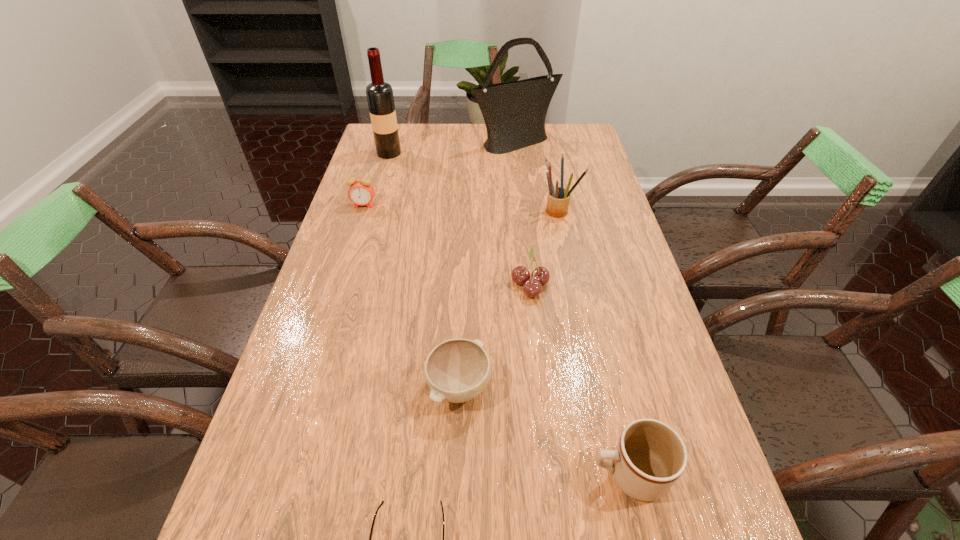
Where is `blank area located 0.140m on the front of the third tallest object`? blank area located 0.140m on the front of the third tallest object is located at coordinates (568, 251).

Locate an element on the screen. The image size is (960, 540). free spot located 0.220m on the face of the alarm clock is located at coordinates (348, 258).

You are a GUI agent. You are given a task and a screenshot of the screen. Output one action in this format:
    pyautogui.click(x=<x>, y=<y>)
    Task: Click on the free space located on the side of the mug with the handle
    The height and width of the screenshot is (540, 960).
    Given the screenshot: What is the action you would take?
    pyautogui.click(x=464, y=474)

Where is `vacant space located 0.310m on the side of the mug with the handle`? The image size is (960, 540). vacant space located 0.310m on the side of the mug with the handle is located at coordinates (413, 474).

Where is `free space located 0.060m on the side of the mug with the handle`? free space located 0.060m on the side of the mug with the handle is located at coordinates (555, 474).

At what (x,y) coordinates should I click in order to perform the action: click on free location located on the leaves of the cherry. Please return your answer as a coordinate pair (x, y). The image size is (960, 540). Looking at the image, I should click on (446, 284).

This screenshot has height=540, width=960. In order to click on free spot located 0.260m on the leaves of the cherry in this screenshot , I will do `click(407, 284)`.

Locate an element on the screen. The width and height of the screenshot is (960, 540). free region located 0.290m on the leaves of the cherry is located at coordinates (395, 284).

Where is `vacant area situated on the left of the bowl`? Image resolution: width=960 pixels, height=540 pixels. vacant area situated on the left of the bowl is located at coordinates click(x=289, y=387).

At what (x,y) coordinates should I click in order to perform the action: click on shoulder bag present at the far edge. Please return your answer as a coordinate pair (x, y). This screenshot has width=960, height=540. Looking at the image, I should click on (514, 112).